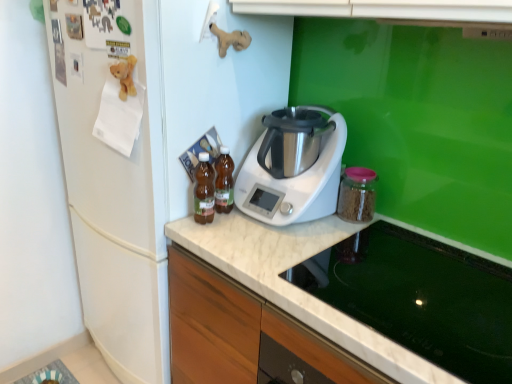
In order to click on vacant region in front of transparent glass jar at right, the 4th kitchen appliance in the left-to-right sequence in this screenshot , I will do `click(339, 234)`.